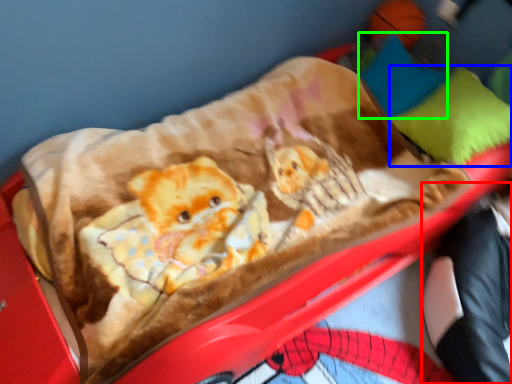
Question: Which is farther away from couple (highlighted by a red box)? pillow (highlighted by a blue box) or pillow (highlighted by a green box)?

Choices:
 (A) pillow
 (B) pillow

Answer: (B)